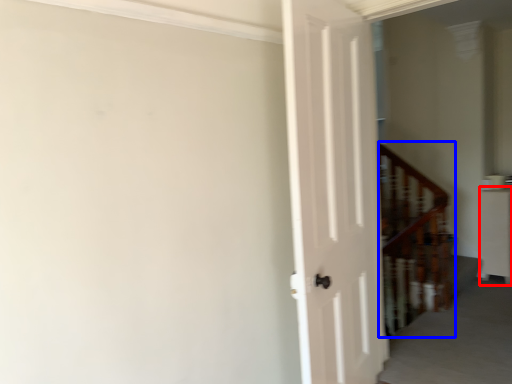
Question: Which point is further to the camera, furniture (highlighted by a red box) or stairwell (highlighted by a blue box)?

Choices:
 (A) furniture
 (B) stairwell

Answer: (A)